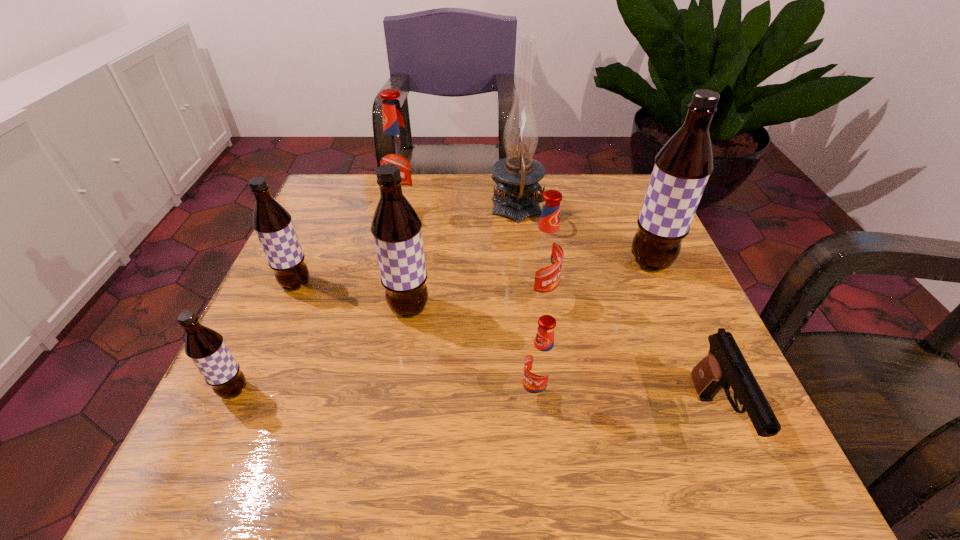
What are the coordinates of `oil lamp present at the far edge` in the screenshot? It's located at (516, 197).

Find the location of a particular element. This screenshot has height=540, width=960. root beer situated at the far edge is located at coordinates (396, 149).

Image resolution: width=960 pixels, height=540 pixels. In order to click on object located in the near edge section of the desktop in this screenshot , I will do `click(724, 366)`.

In order to click on root beer that is at the right edge in this screenshot , I will do `click(682, 167)`.

The width and height of the screenshot is (960, 540). What are the coordinates of `pistol located at the right edge` in the screenshot? It's located at (724, 366).

The width and height of the screenshot is (960, 540). What are the coordinates of `object that is at the near right corner` in the screenshot? It's located at (724, 366).

Identify the location of free location at the far edge. This screenshot has width=960, height=540. (490, 184).

The height and width of the screenshot is (540, 960). In order to click on vacant space at the near edge of the desktop in this screenshot , I will do (430, 430).

At what (x,y) coordinates should I click in order to perform the action: click on free point at the left edge. Please return your answer as a coordinate pair (x, y). Looking at the image, I should click on (258, 320).

At what (x,y) coordinates should I click in order to perform the action: click on vacant space at the right edge of the desktop. Please return your answer as a coordinate pair (x, y). This screenshot has height=540, width=960. Looking at the image, I should click on pyautogui.click(x=699, y=350).